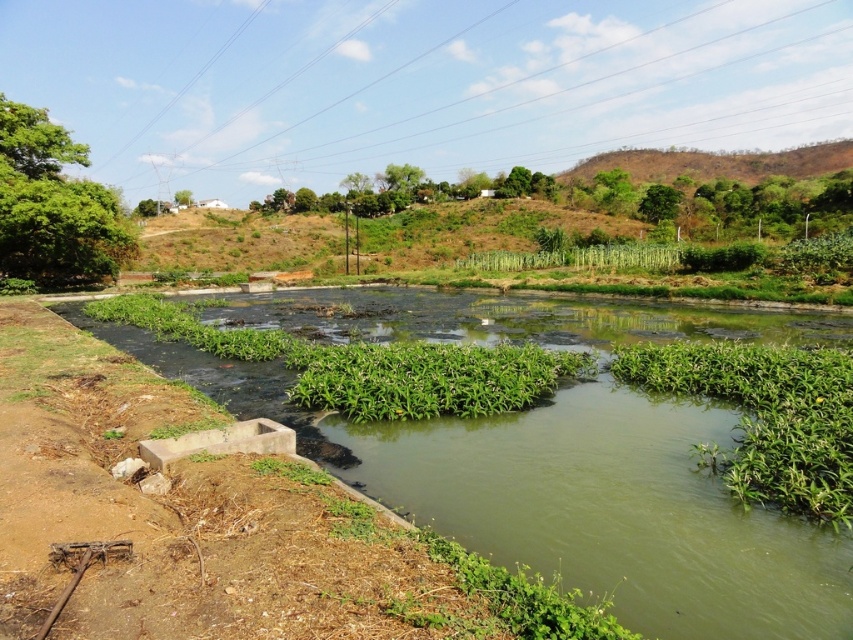
Is the position of green leafy tree at left less distant than that of brown dry grass at upper right?

Yes, green leafy tree at left is closer to the viewer.

Is point (90, 218) less distant than point (686, 161)?

That is True.

I want to click on green leafy tree at left, so click(x=53, y=205).

Which is in front, point (850, 109) or point (730, 176)?

Point (730, 176)

At what (x,y) coordinates should I click in order to perform the action: click on clear plastic power lines at upper center. Please return your answer as a coordinate pair (x, y). Looking at the image, I should click on (509, 93).

Find the location of a particular element. clear plastic power lines at upper center is located at coordinates (509, 93).

Where is `clear plastic power lines at upper center`? clear plastic power lines at upper center is located at coordinates (509, 93).